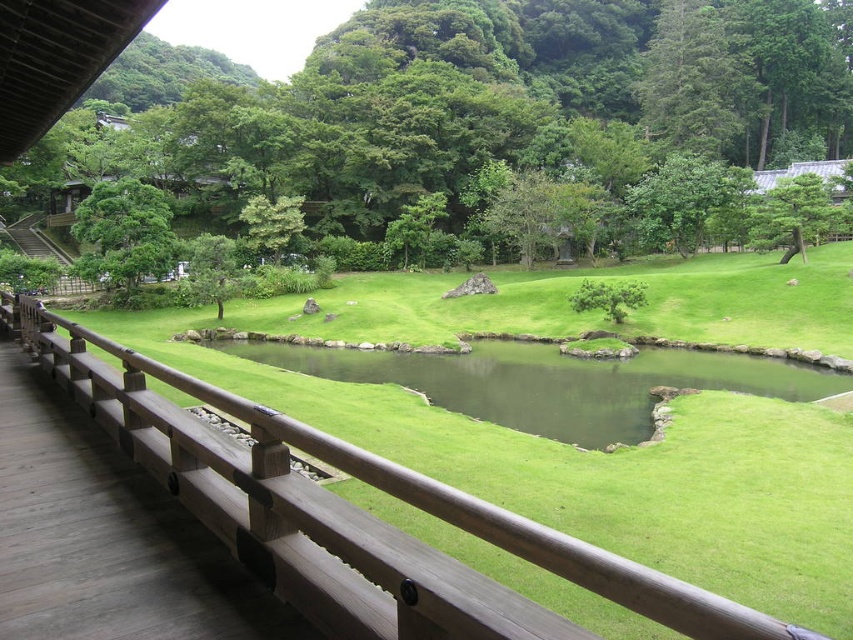
This screenshot has width=853, height=640. What do you see at coordinates (550, 381) in the screenshot?
I see `green water at center` at bounding box center [550, 381].

The image size is (853, 640). What do you see at coordinates (550, 381) in the screenshot? I see `green water at center` at bounding box center [550, 381].

Where is `green water at center`? The width and height of the screenshot is (853, 640). green water at center is located at coordinates (550, 381).

Does brown wooden rail at left appear under green leafy tree at upper left?

Yes.

Is brown wooden rail at left further to the viewer compared to green leafy tree at upper left?

No, it is not.

Image resolution: width=853 pixels, height=640 pixels. I want to click on brown wooden rail at left, so click(x=352, y=515).

At what (x,y) coordinates should I click in order to perform the action: click on brown wooden rail at left. Please return your answer as a coordinate pair (x, y). Image resolution: width=853 pixels, height=640 pixels. Looking at the image, I should click on (352, 515).

Can you confirm if brown wooden rail at left is smaller than green textured pine tree at upper right?

Indeed, brown wooden rail at left has a smaller size compared to green textured pine tree at upper right.

Between point (334, 496) and point (784, 208), which one is positioned in front?

Positioned in front is point (334, 496).

Is point (415, 628) positioned before point (788, 212)?

Yes.

The height and width of the screenshot is (640, 853). I want to click on brown wooden rail at left, so click(x=352, y=515).